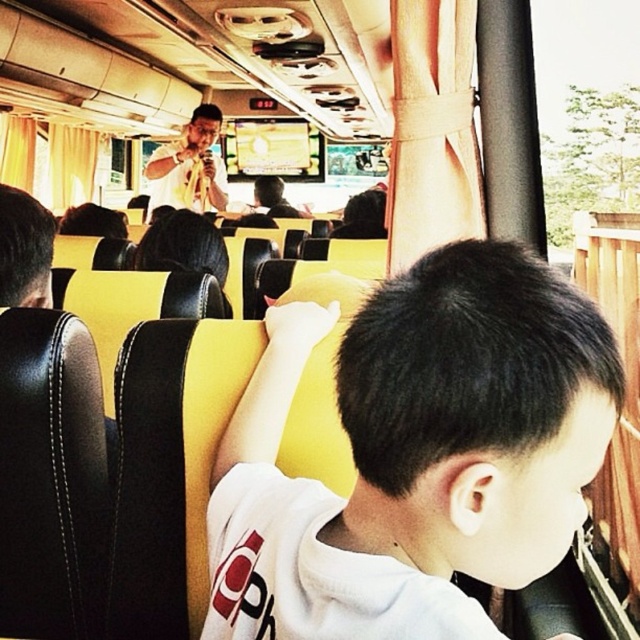
You are a passenger on the bus and want to take a photo of the speaker. The white matte shirt at center and the matte yellow shirt at upper center are blocking your view. Which shirt should you move to the left to get an unobstructed view?

You should move the white matte shirt at center to the left since it is already to the right of the matte yellow shirt at upper center, so shifting it left would clear the view.

You are a passenger on the bus and want to see the speaker clearly. There are two shirts in your view, the white matte shirt at center and the matte yellow shirt at upper center. Which shirt do you need to look around to get a better view of the speaker?

The white matte shirt at center is in front of the matte yellow shirt at upper center. To see the speaker clearly, you need to look around the white matte shirt at center since it is blocking your view.